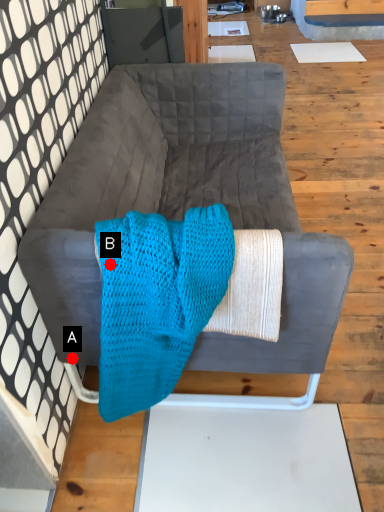
Question: Two points are circled on the image, labeled by A and B beside each circle. Among these points, which one is nearest to the camera?

Choices:
 (A) A is closer
 (B) B is closer

Answer: (B)